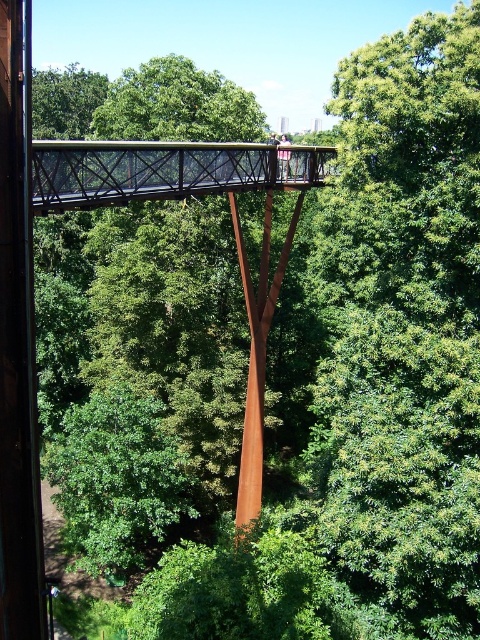
Which is behind, point (232, 170) or point (241, 440)?

Positioned behind is point (241, 440).

Describe the element at coordinates (165, 170) in the screenshot. I see `rustic metal bridge at center` at that location.

Locate an element on the screen. Image resolution: width=480 pixels, height=640 pixels. rustic metal bridge at center is located at coordinates (165, 170).